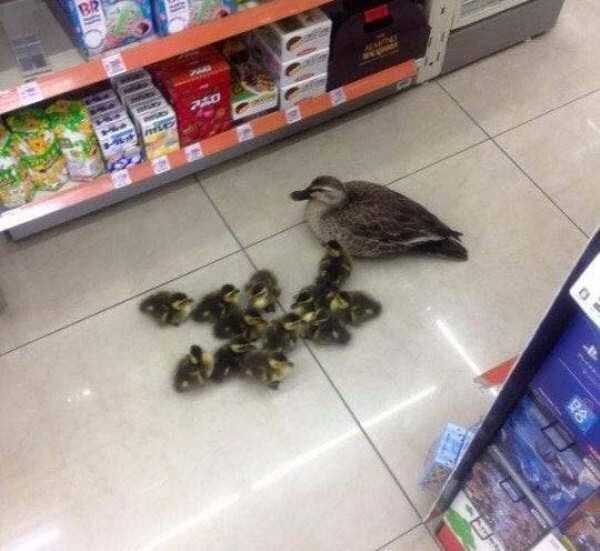
Identify the location of rack. coord(80,79).